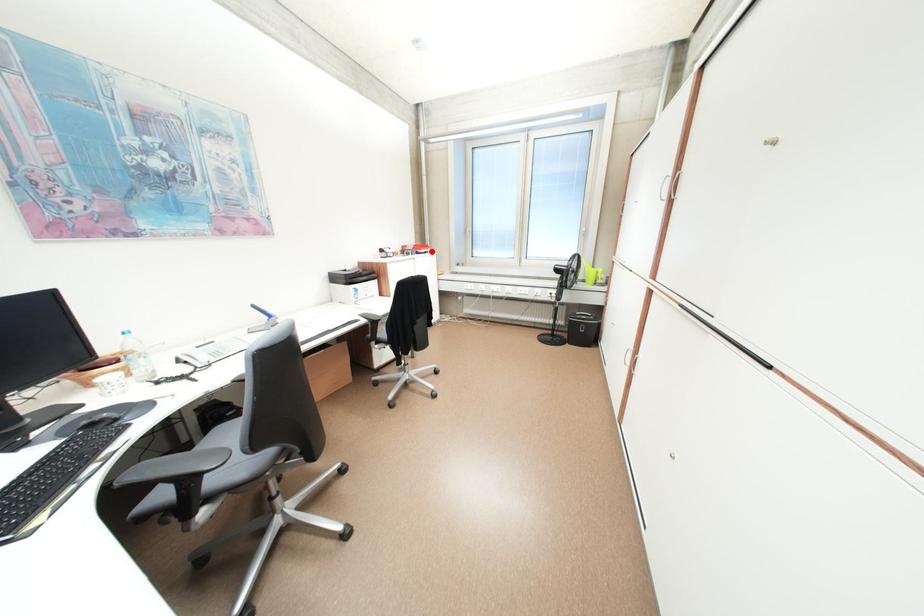
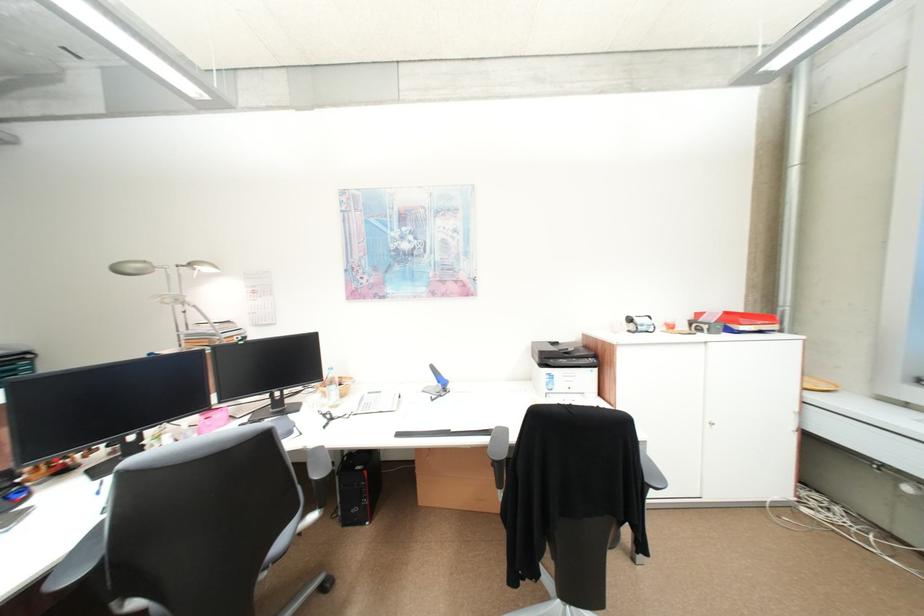
Question: I am providing you with two images of the same scene from different viewpoints. Image1 has a red point marked. In image2, the corresponding 3D location appears at what relative position? Reply with the corresponding letter.

Choices:
 (A) Closer
 (B) Farther

Answer: (B)